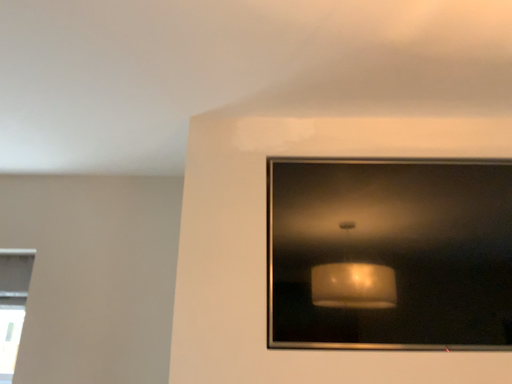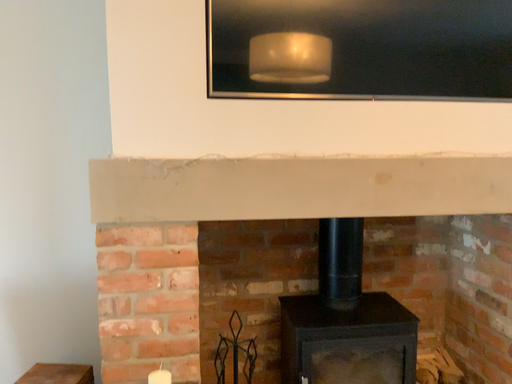
Question: Which way did the camera rotate in the video?

Choices:
 (A) rotated downward
 (B) rotated upward

Answer: (A)